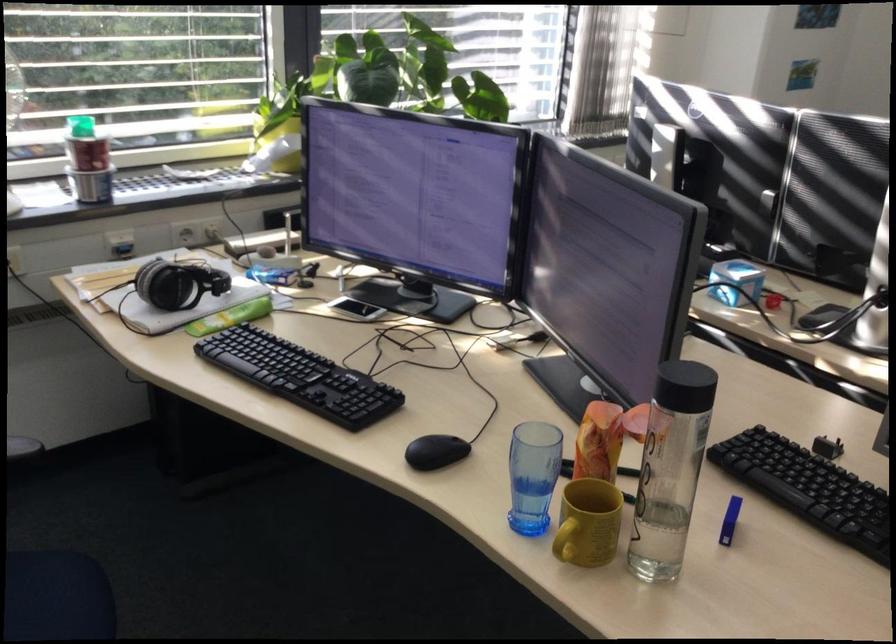
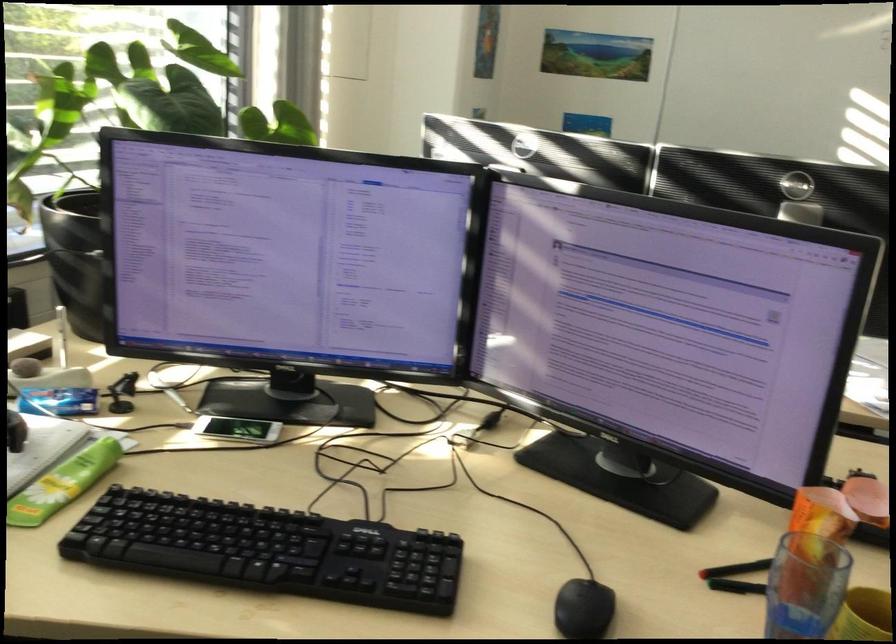
Find the pixel in the second image that matches (x=367, y=401) in the first image.

(424, 565)